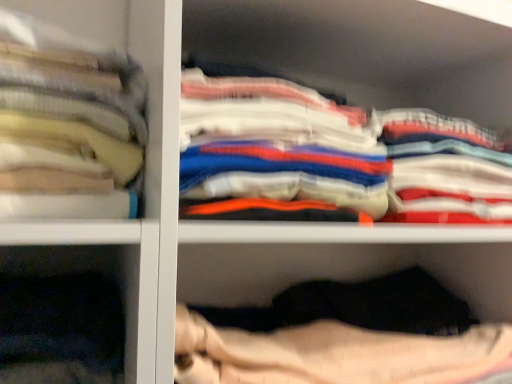
Question: Would you say white cotton shirts at center, placed as the second clothing when sorted from right to left, is inside or outside soft cotton towels at left, which appears as the 1th clothing when viewed from the left?

Choices:
 (A) outside
 (B) inside

Answer: (A)

Question: Looking at the image, does white cotton shirts at center, placed as the second clothing when sorted from right to left, seem bigger or smaller compared to soft cotton towels at left, arranged as the third clothing when viewed from the right?

Choices:
 (A) small
 (B) big

Answer: (B)

Question: Based on their relative distances, which object is farther from the soft cotton towels at left, arranged as the third clothing when viewed from the right?

Choices:
 (A) white cotton shirts at upper right, the 3th clothing in the left-to-right sequence
 (B) white cotton shirts at center, placed as the second clothing when sorted from right to left

Answer: (A)

Question: Which of these objects is positioned closest to the white cotton shirts at center, the second clothing viewed from the left?

Choices:
 (A) soft cotton towels at left, which appears as the 1th clothing when viewed from the left
 (B) white cotton shirts at upper right, the 3th clothing in the left-to-right sequence

Answer: (B)